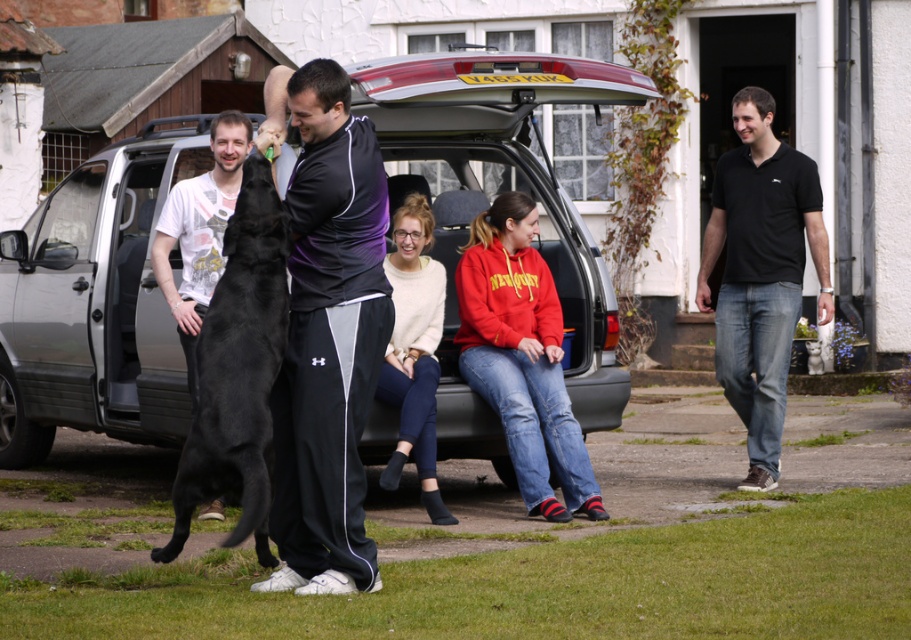
Question: Among these points, which one is nearest to the camera?

Choices:
 (A) (426, 257)
 (B) (146, 364)
 (C) (189, 493)

Answer: (C)

Question: Is purple/black track pants at center positioned behind soft cream sweater at center?

Choices:
 (A) yes
 (B) no

Answer: (B)

Question: Does metallic silver suv at center appear under black fur dog at center?

Choices:
 (A) yes
 (B) no

Answer: (B)

Question: Does black cotton polo shirt at right have a lesser width compared to black fur dog at center?

Choices:
 (A) no
 (B) yes

Answer: (A)

Question: Which of these objects is positioned closest to the black fur dog at center?

Choices:
 (A) metallic silver suv at center
 (B) purple/black track pants at center
 (C) soft cream sweater at center

Answer: (B)

Question: Estimate the real-world distances between objects in this image. Which object is farther from the black fur dog at center?

Choices:
 (A) soft cream sweater at center
 (B) purple/black track pants at center

Answer: (A)